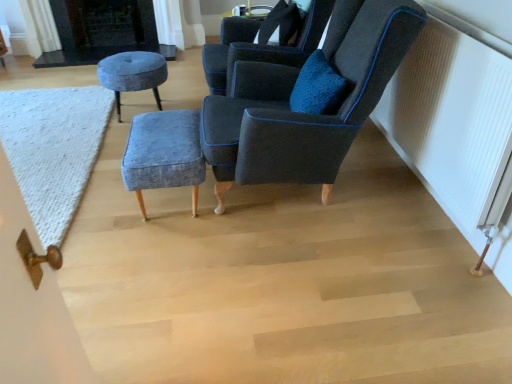
Where is `empty space that is in between velvet dark blue chair at upper right, which appears as the second chair when viewed from the back, and white textured radiator at right`? This screenshot has height=384, width=512. empty space that is in between velvet dark blue chair at upper right, which appears as the second chair when viewed from the back, and white textured radiator at right is located at coordinates click(362, 234).